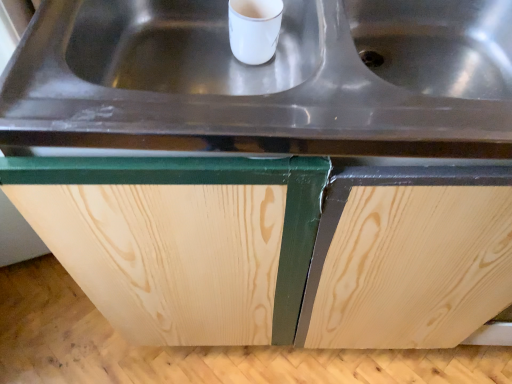
Question: Visually, is natural wood cabinet at center positioned to the left or to the right of stainless steel sink at center?

Choices:
 (A) left
 (B) right

Answer: (A)

Question: Considering their positions, is natural wood cabinet at center located in front of or behind stainless steel sink at center?

Choices:
 (A) behind
 (B) front

Answer: (A)

Question: From a real-world perspective, is natural wood cabinet at center physically located above or below stainless steel sink at center?

Choices:
 (A) above
 (B) below

Answer: (B)

Question: Is stainless steel sink at center wider or thinner than natural wood cabinet at center?

Choices:
 (A) wide
 (B) thin

Answer: (B)

Question: From a real-world perspective, is stainless steel sink at center above or below natural wood cabinet at center?

Choices:
 (A) below
 (B) above

Answer: (B)

Question: From the image's perspective, is stainless steel sink at center above or below natural wood cabinet at center?

Choices:
 (A) below
 (B) above

Answer: (B)

Question: Is stainless steel sink at center inside the boundaries of natural wood cabinet at center, or outside?

Choices:
 (A) outside
 (B) inside

Answer: (B)